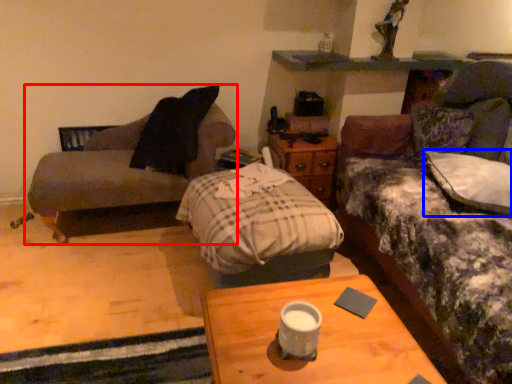
Question: Among these objects, which one is nearest to the camera, studio couch (highlighted by a red box) or pillow (highlighted by a blue box)?

Choices:
 (A) studio couch
 (B) pillow

Answer: (B)